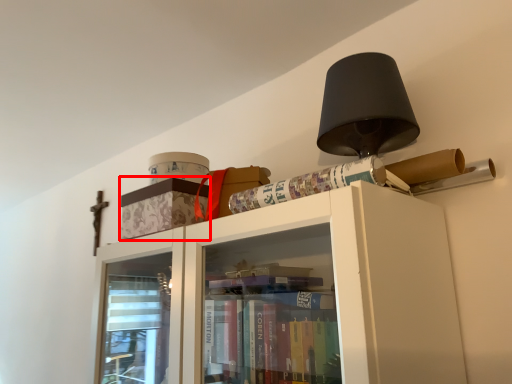
Question: Observing the image, what is the correct spatial positioning of cabinetry (annotated by the red box) in reference to paperback book?

Choices:
 (A) right
 (B) left

Answer: (B)